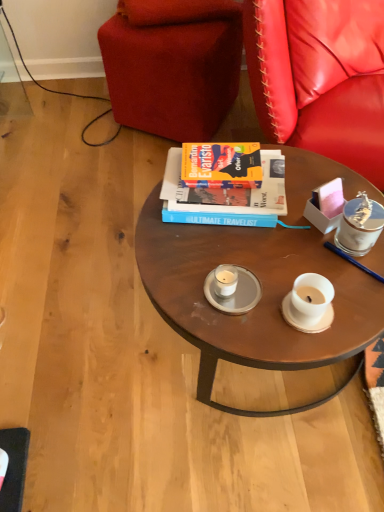
Question: Based on their sizes in the image, would you say clear glass saucer at center is bigger or smaller than hardcover book at center?

Choices:
 (A) small
 (B) big

Answer: (A)

Question: Considering the positions of point (256, 295) and point (273, 163), is point (256, 295) closer or farther from the camera than point (273, 163)?

Choices:
 (A) farther
 (B) closer

Answer: (B)

Question: Considering the real-world distances, which object is farthest from the silver metallic candle at upper right, which is counted as the 2th coffee cup, starting from the left?

Choices:
 (A) white matte candle at center, marked as the first coffee cup in a bottom-to-top arrangement
 (B) clear glass saucer at center
 (C) hardcover book at center
 (D) velvet red studio couch at upper center
 (E) wooden round table at center

Answer: (D)

Question: Which object is the farthest from the hardcover book at center?

Choices:
 (A) velvet red studio couch at upper center
 (B) silver metallic candle at upper right, the first coffee cup when ordered from top to bottom
 (C) wooden round table at center
 (D) clear glass saucer at center
 (E) white matte candle at center, which is the second coffee cup from top to bottom

Answer: (A)